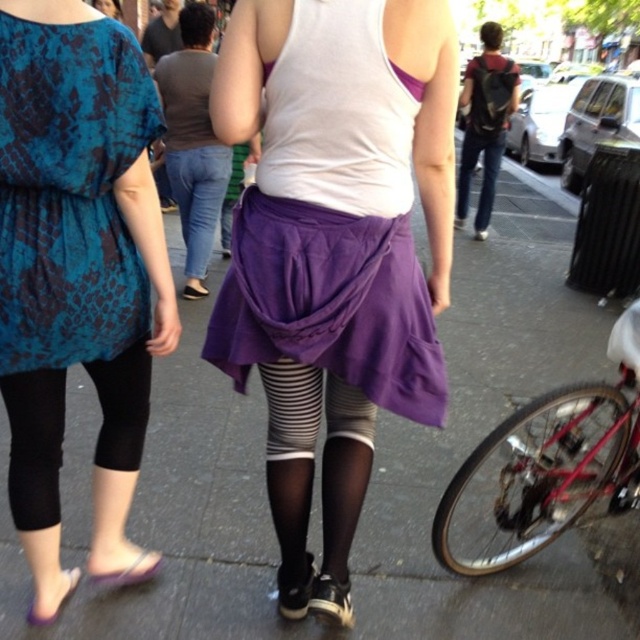
You are a delivery person who needs to load a shiny red bicycle at lower right onto a truck. The truck has a height restriction of 1.5 meters. Given that the purple fabric skirt at center is 1.8 meters tall, will the bicycle fit through the truck entrance?

The shiny red bicycle at lower right is not as tall as the purple fabric skirt at center, which is 1.8 meters tall. Since the bicycle is shorter than the skirt, it will be under 1.8 meters and thus fit under the truck entrance height of 1.5 meters.

You are standing at the center of the street and see the shiny red bicycle at lower right and the purple fabric skirt at center. Which object is positioned to the right side of the other?

The shiny red bicycle at lower right is to the right of the purple fabric skirt at center.

You are standing at the center of the street and want to locate the purple quilted skirt at center. According to the coordinates provided, in which direction should you look to find it?

The purple quilted skirt at center is located at coordinates point (333,250). Since you are at the center, you should look directly ahead as the skirt is at the center of the image.